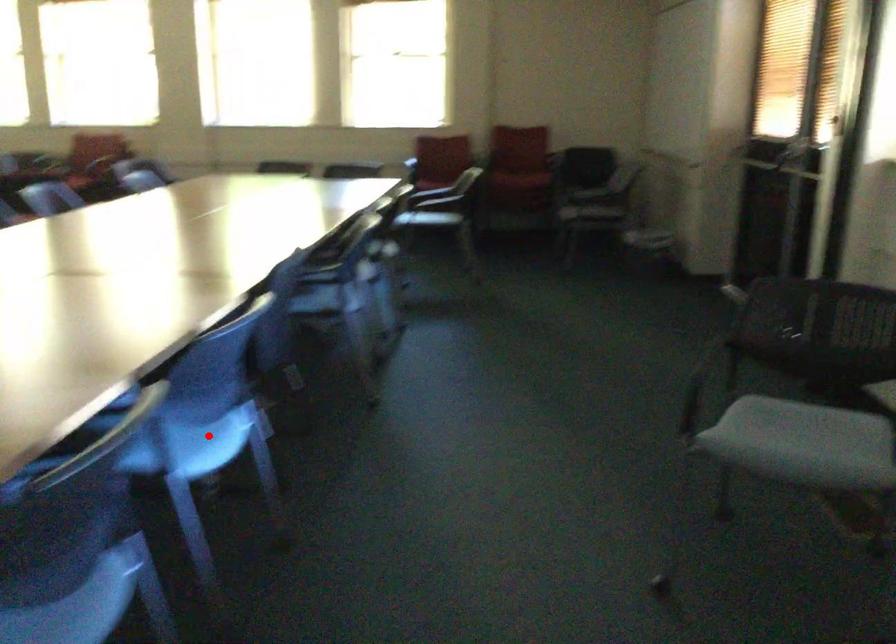
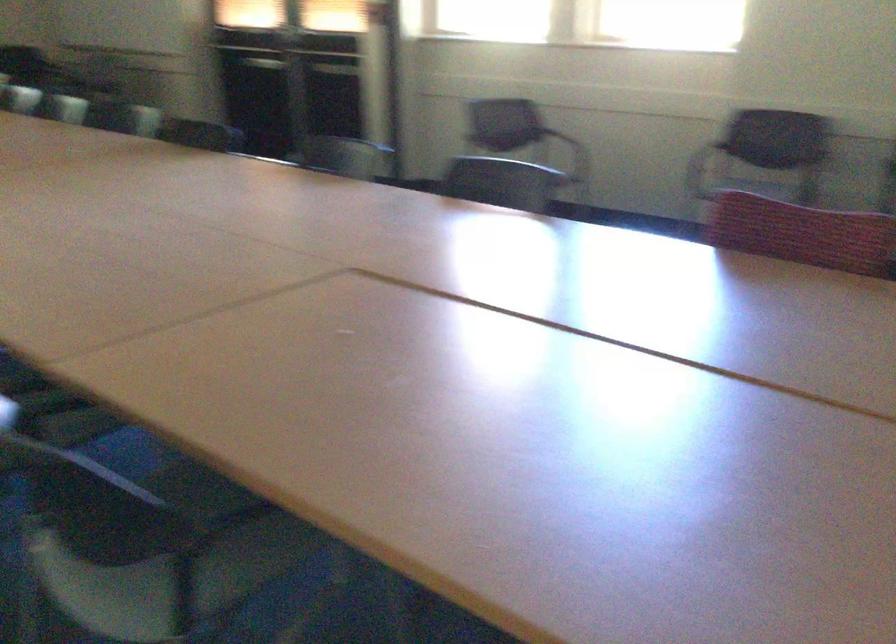
Question: I am providing you with two images of the same scene from different viewpoints. A red point is marked on the first image. At the location where the point appears in image 1, is it still visible in image 2?

Choices:
 (A) Yes
 (B) No

Answer: (B)